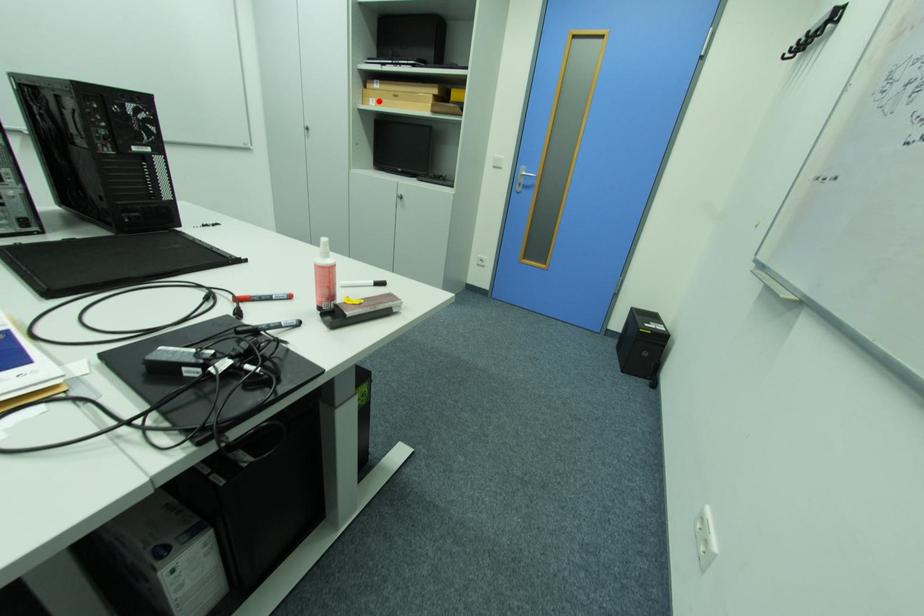
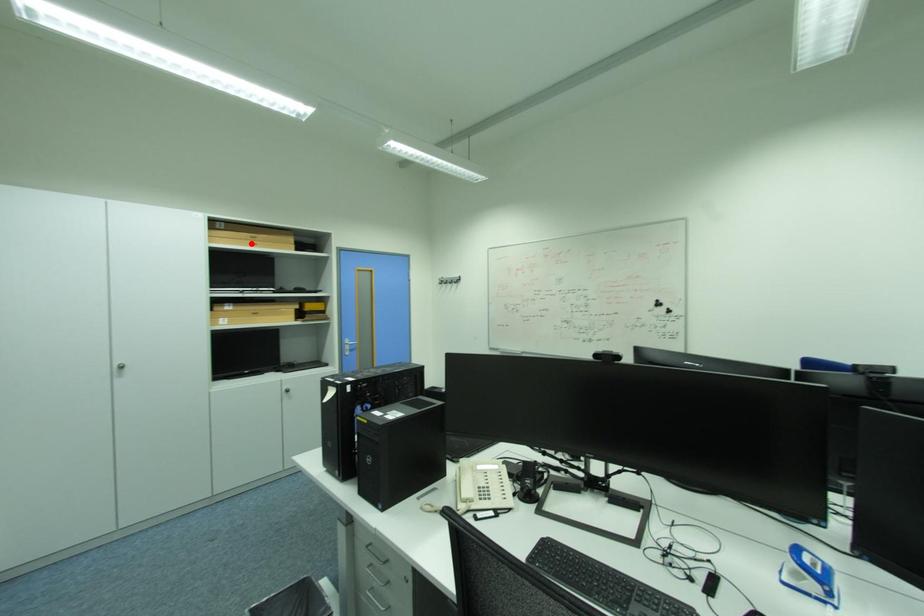
I am providing you with two images of the same scene from different viewpoints. A red point is marked on the first image and another point is marked on the second image. Is the marked point in image1 the same physical position as the marked point in image2?

No